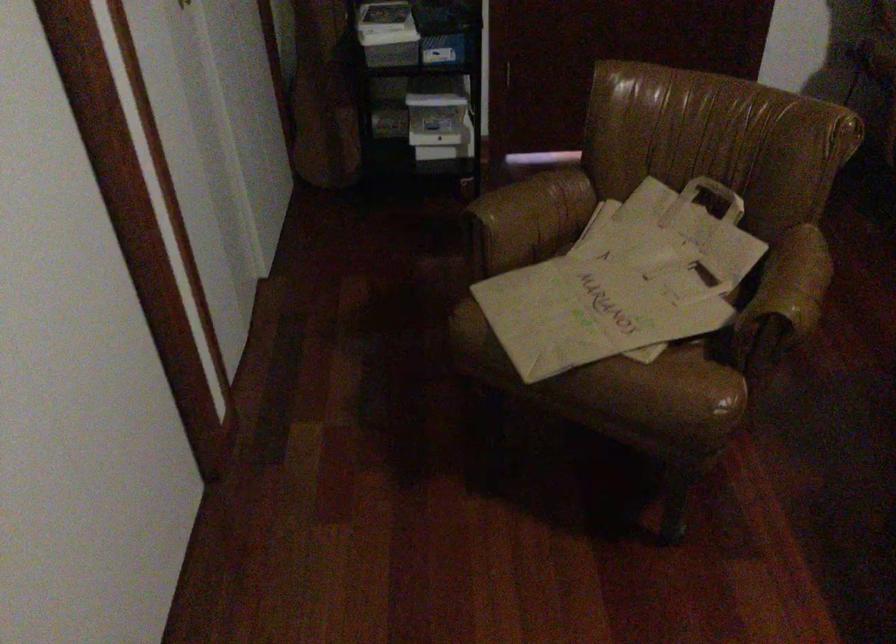
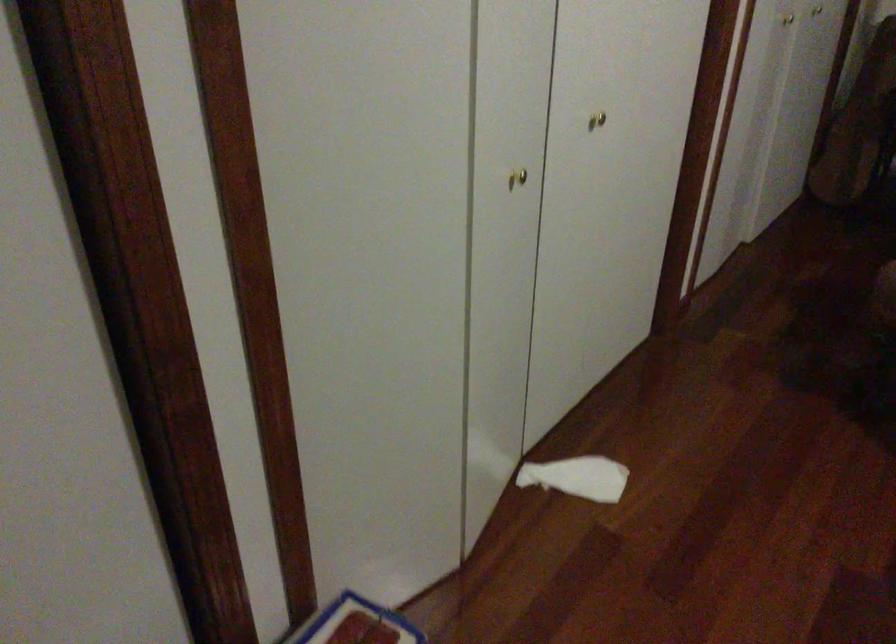
Question: How did the camera likely rotate?

Choices:
 (A) Left
 (B) Right
 (C) Up
 (D) Down

Answer: (A)